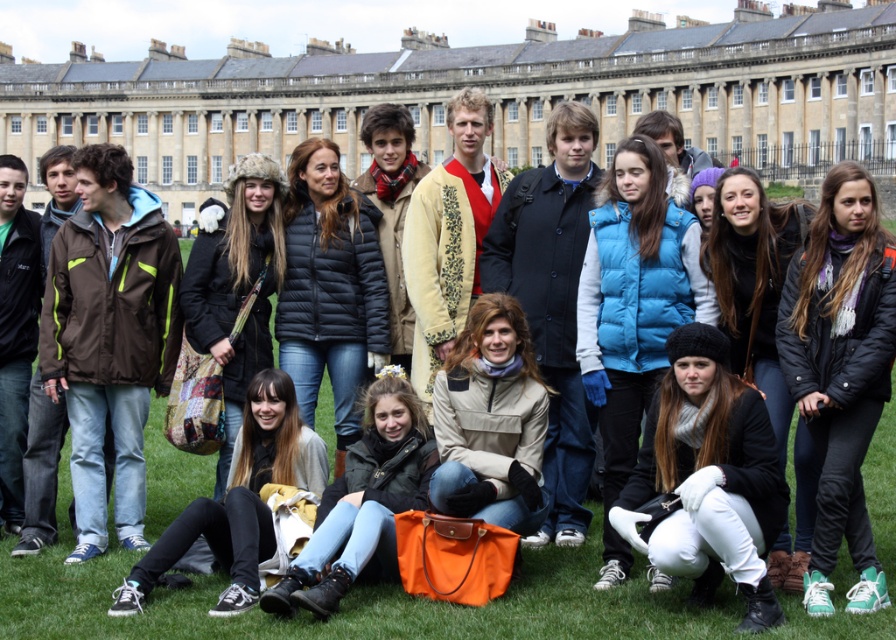
Question: Can you confirm if smooth stone palace at center is positioned to the left of blue puffy vest at center?

Choices:
 (A) yes
 (B) no

Answer: (A)

Question: Which is farther from the leather jacket at lower center?

Choices:
 (A) matte yellow jacket at lower center
 (B) smooth stone palace at center
 (C) white fleece pants at lower center

Answer: (B)

Question: Estimate the real-world distances between objects in this image. Which object is farther from the matte yellow jacket at lower center?

Choices:
 (A) tan fabric jacket at center
 (B) blue puffy vest at center
 (C) white fleece pants at lower center
 (D) leather jacket at lower center

Answer: (C)

Question: Among these objects, which one is farthest from the camera?

Choices:
 (A) smooth stone palace at center
 (B) blue puffy vest at center
 (C) white fleece pants at lower center

Answer: (A)

Question: Can you confirm if black fuzzy hat at upper center is positioned to the right of blue puffy vest at center?

Choices:
 (A) no
 (B) yes

Answer: (B)

Question: Considering the relative positions of black fuzzy hat at upper center and leather jacket at lower center in the image provided, where is black fuzzy hat at upper center located with respect to leather jacket at lower center?

Choices:
 (A) left
 (B) right

Answer: (B)